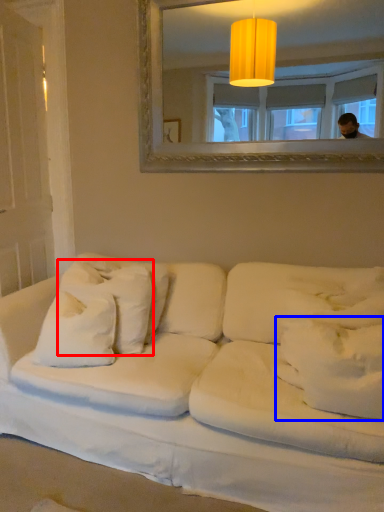
Question: Which point is further to the camera, pillow (highlighted by a red box) or pillow (highlighted by a blue box)?

Choices:
 (A) pillow
 (B) pillow

Answer: (A)